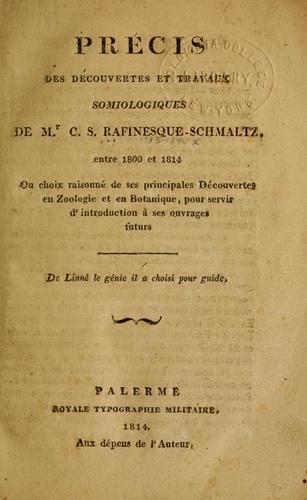
The image size is (307, 500). In order to click on accents in this screenshot , I will do `click(108, 439)`, `click(86, 274)`, `click(113, 274)`, `click(136, 32)`, `click(84, 70)`, `click(102, 180)`, `click(209, 180)`, `click(143, 208)`.